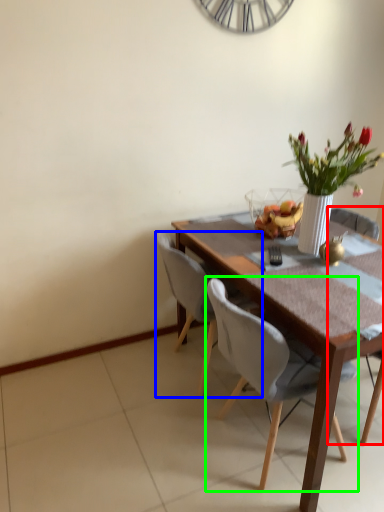
Question: Which is nearer to the chair (highlighted by a red box)? chair (highlighted by a blue box) or chair (highlighted by a green box).

Choices:
 (A) chair
 (B) chair

Answer: (A)